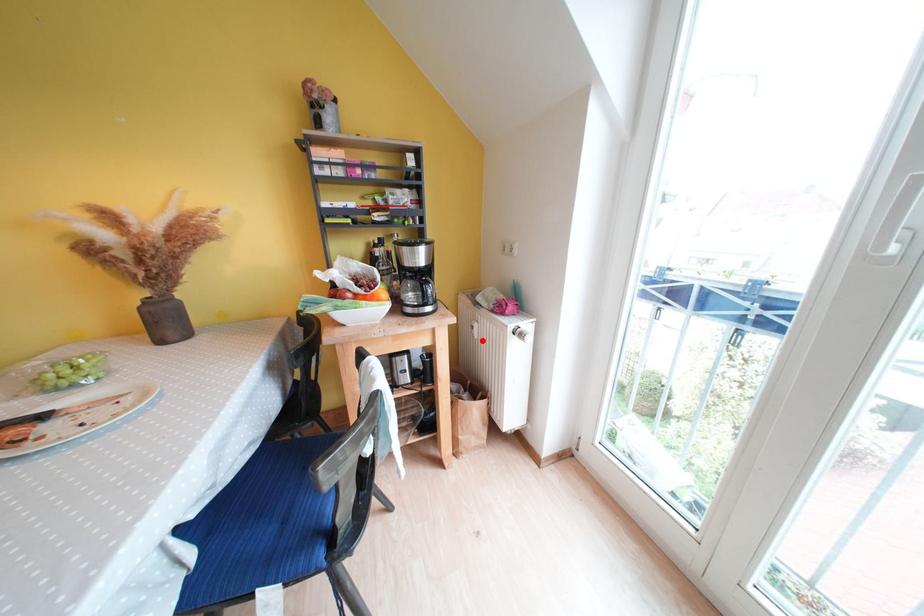
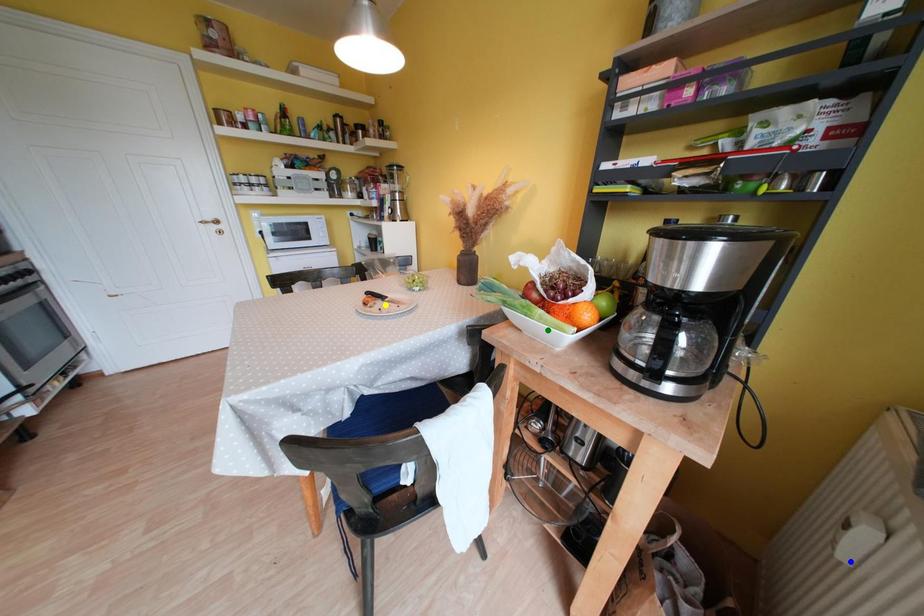
Question: I am providing you with two images of the same scene from different viewpoints. A red point is marked on the first image. You are given multiple points on the second image. Which mark in image 2 goes with the point in image 1?

Choices:
 (A) green point
 (B) yellow point
 (C) blue point

Answer: (C)